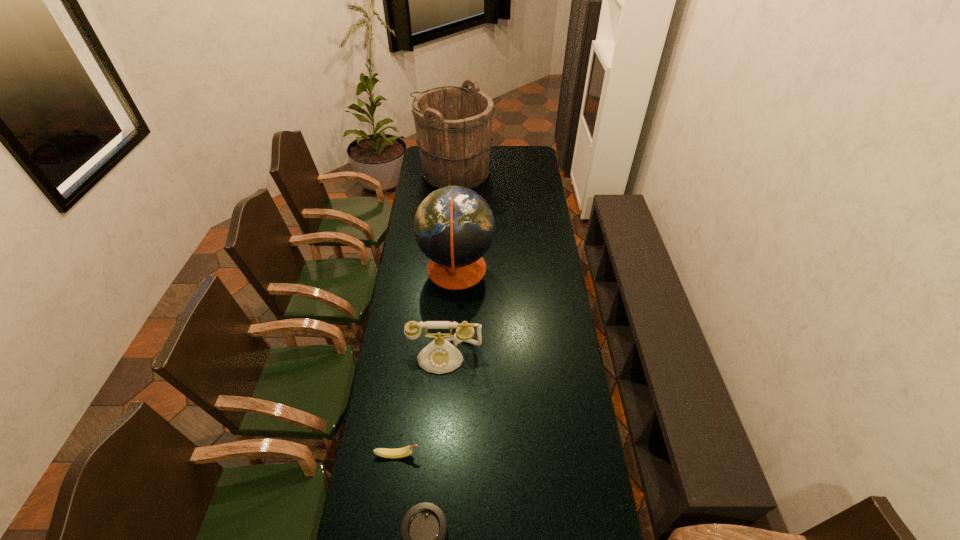
At what (x,y) coordinates should I click in order to perform the action: click on the farthest object. Please return your answer as a coordinate pair (x, y). This screenshot has height=540, width=960. Looking at the image, I should click on (453, 124).

The height and width of the screenshot is (540, 960). Identify the location of the fourth nearest object. (454, 227).

This screenshot has width=960, height=540. I want to click on telephone, so click(x=440, y=356).

Locate an element on the screen. the third farthest object is located at coordinates (440, 356).

At what (x,y) coordinates should I click in order to perform the action: click on the second nearest object. Please return your answer as a coordinate pair (x, y). The image size is (960, 540). Looking at the image, I should click on (405, 451).

Where is `banana`? The image size is (960, 540). banana is located at coordinates (405, 451).

This screenshot has height=540, width=960. Find the location of `vacant area situated 0.200m on the right of the farthest object`. vacant area situated 0.200m on the right of the farthest object is located at coordinates (527, 173).

At what (x,y) coordinates should I click in order to perform the action: click on free point located 0.120m with the Americas facing the viewer on the second farthest object. Please return your answer as a coordinate pair (x, y). The image size is (960, 540). Looking at the image, I should click on (520, 270).

Identify the location of free space located 0.380m on the dial of the third farthest object. The image size is (960, 540). (437, 480).

The width and height of the screenshot is (960, 540). Identify the location of free space located 0.170m at the stem of the banana. (472, 455).